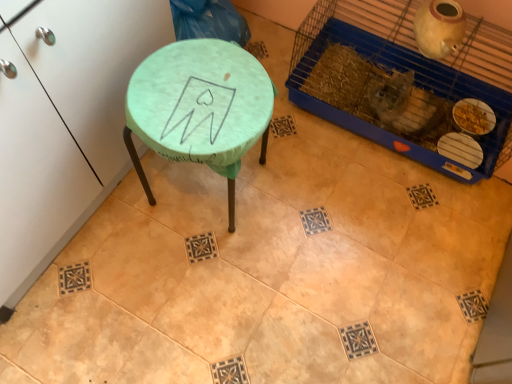
Locate an element on the screen. Image resolution: width=512 pixels, height=384 pixels. spots to the right of matte green stool at center is located at coordinates (306, 201).